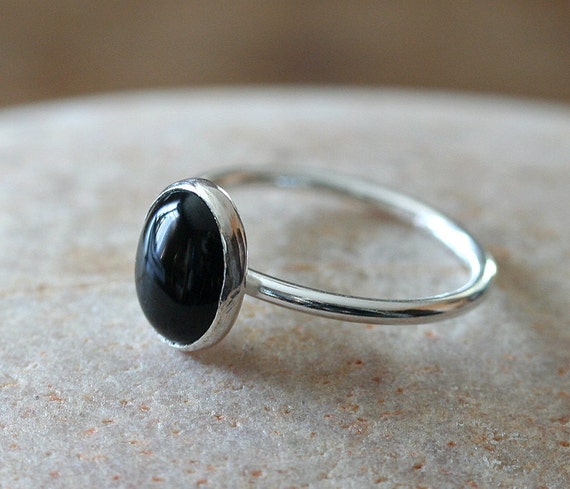
The width and height of the screenshot is (570, 489). Find the location of `reflection of window in ring`. reflection of window in ring is located at coordinates (161, 235).